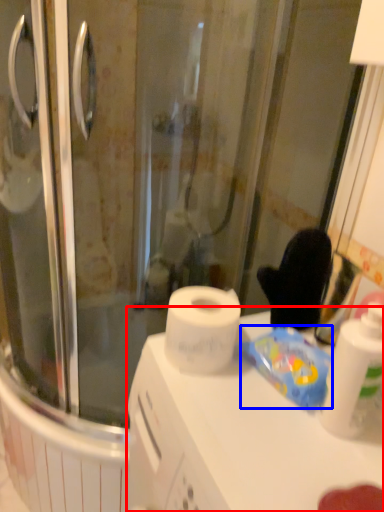
Question: Which of the following is the closest to the observer, counter top (highlighted by a red box) or food (highlighted by a blue box)?

Choices:
 (A) counter top
 (B) food

Answer: (A)